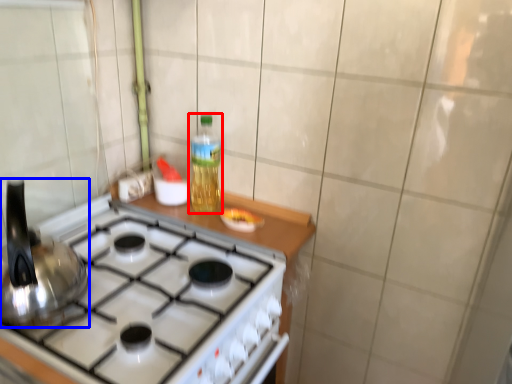
Question: Which of the following is the closest to the observer, bottle (highlighted by a red box) or kitchen appliance (highlighted by a blue box)?

Choices:
 (A) bottle
 (B) kitchen appliance

Answer: (B)